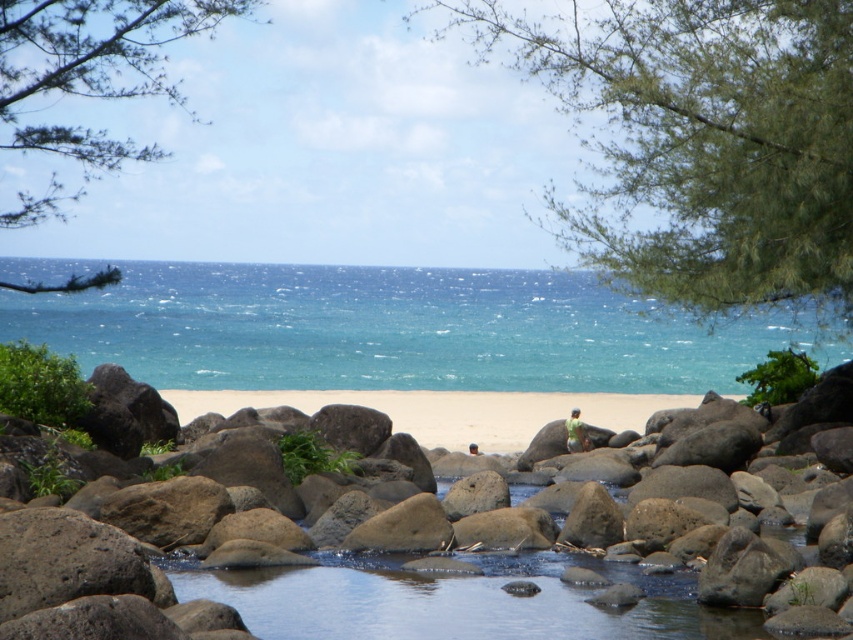
You are standing on the beach and see the blue water at center and the green fabric shirt at center. Which object is positioned to the left?

The blue water at center is positioned to the left of the green fabric shirt at center.

You are standing on the beach and see the blue water at center and the green fabric shirt at center. Which object takes up more space in the image?

The blue water at center is larger in size than the green fabric shirt at center, so it takes up more space in the image.